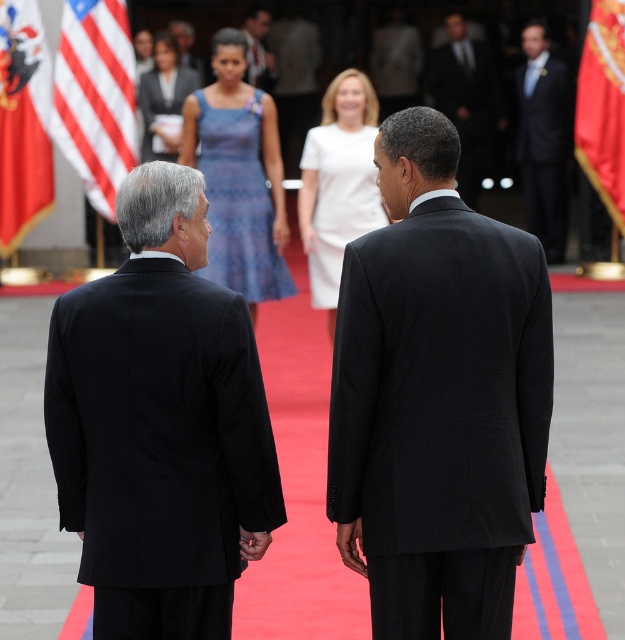
Consider the image. Which is above, red-white striped flag at upper left or red fabric flag at left?

red-white striped flag at upper left is higher up.

Between red-white striped flag at upper left and red fabric flag at left, which one appears on the right side from the viewer's perspective?

red-white striped flag at upper left is more to the right.

What are the coordinates of `red-white striped flag at upper left` in the screenshot? It's located at (96, 97).

This screenshot has height=640, width=625. Identify the location of red-white striped flag at upper left. (96, 97).

Can you confirm if black wool suit at left is wider than red-white striped flag at upper left?

Yes.

Is point (178, 490) positioned in front of point (118, 68)?

Yes, point (178, 490) is in front of point (118, 68).

Locate an element on the screen. black wool suit at left is located at coordinates (161, 422).

Who is shorter, red fabric flag at left or black suit at upper center?

With less height is red fabric flag at left.

How far apart are red fabric flag at left and black suit at upper center?

red fabric flag at left is 6.64 meters from black suit at upper center.

Is point (22, 17) positioned in front of point (466, 161)?

That is True.

This screenshot has width=625, height=640. Find the location of `red fabric flag at left`. red fabric flag at left is located at coordinates (22, 122).